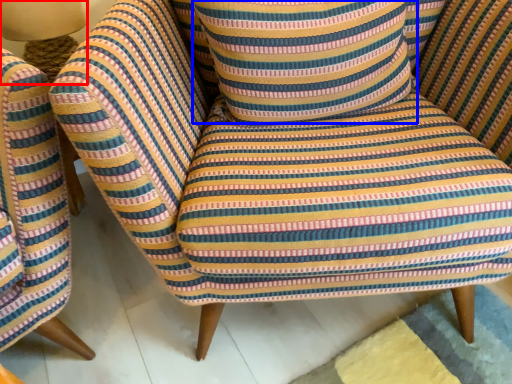
Question: Which object is closer to the camera taking this photo, table lamp (highlighted by a red box) or throw pillow (highlighted by a blue box)?

Choices:
 (A) table lamp
 (B) throw pillow

Answer: (B)